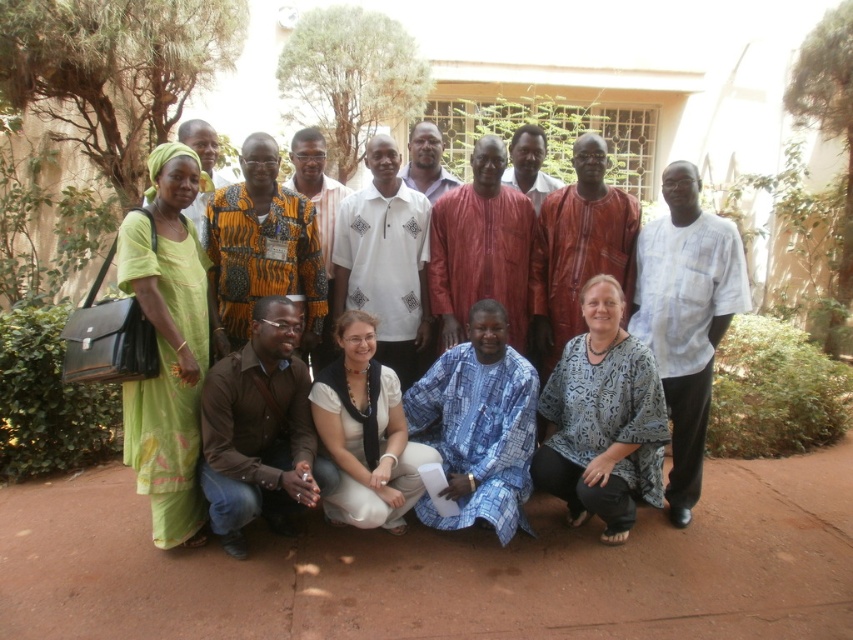
Is point (354, 336) behind point (556, 180)?

No, (354, 336) is in front of (556, 180).

Who is shorter, white cotton blouse at center or blue patterned shirt at center?

With less height is blue patterned shirt at center.

Between point (386, 387) and point (538, 140), which one is positioned in front?

Point (386, 387) is in front.

Locate an element on the screen. white cotton blouse at center is located at coordinates (364, 433).

Between patterned fabric blouse at lower center and matte red fabric at center, which one is positioned higher?

matte red fabric at center is higher up.

Based on the photo, which is more to the left, patterned fabric blouse at lower center or matte red fabric at center?

From the viewer's perspective, matte red fabric at center appears more on the left side.

Does point (657, 422) come closer to viewer compared to point (469, 298)?

Yes, point (657, 422) is in front of point (469, 298).

Identify the location of patterned fabric blouse at lower center. (602, 419).

Measure the distance between patterned fabric blouse at lower center and matte purple shirt at center.

patterned fabric blouse at lower center is 2.13 meters from matte purple shirt at center.

The width and height of the screenshot is (853, 640). Describe the element at coordinates (602, 419) in the screenshot. I see `patterned fabric blouse at lower center` at that location.

You are a GUI agent. You are given a task and a screenshot of the screen. Output one action in this format:
    pyautogui.click(x=<x>, y=<y>)
    Task: Click on the patterned fabric blouse at lower center
    This screenshot has width=853, height=640.
    Given the screenshot: What is the action you would take?
    pyautogui.click(x=602, y=419)